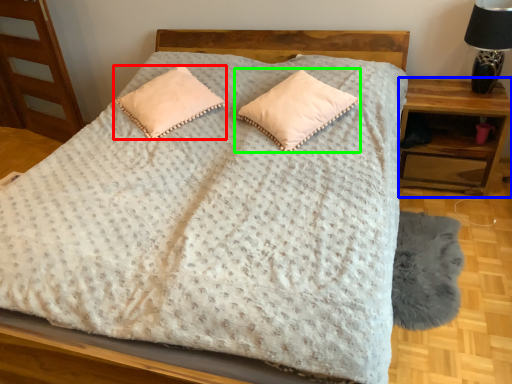
Question: Considering the real-world distances, which object is closest to pillow (highlighted by a red box)? nightstand (highlighted by a blue box) or pillow (highlighted by a green box).

Choices:
 (A) nightstand
 (B) pillow

Answer: (B)